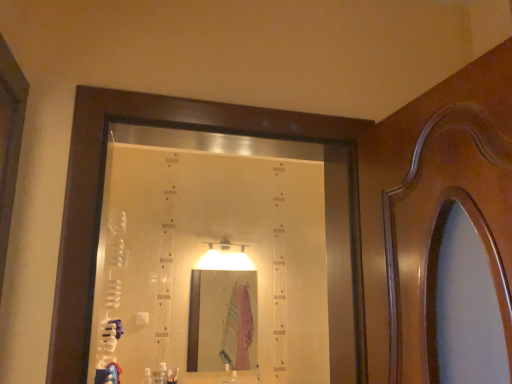
Question: Is white plastic bottle at lower center, positioned as the first toiletry in left-to-right order, positioned in front of pink fabric at center?

Choices:
 (A) yes
 (B) no

Answer: (A)

Question: Considering the relative positions of white plastic bottle at lower center, positioned as the first toiletry in left-to-right order, and pink fabric at center in the image provided, is white plastic bottle at lower center, positioned as the first toiletry in left-to-right order, to the left of pink fabric at center from the viewer's perspective?

Choices:
 (A) no
 (B) yes

Answer: (B)

Question: From a real-world perspective, is white plastic bottle at lower center, which is the second toiletry from right to left, located higher than pink fabric at center?

Choices:
 (A) yes
 (B) no

Answer: (B)

Question: Does white plastic bottle at lower center, positioned as the first toiletry in left-to-right order, have a greater height compared to pink fabric at center?

Choices:
 (A) yes
 (B) no

Answer: (B)

Question: Is white plastic bottle at lower center, positioned as the first toiletry in left-to-right order, placed right next to pink fabric at center?

Choices:
 (A) yes
 (B) no

Answer: (B)

Question: From the image's perspective, is pink fabric at center above or below blue cotton robe at lower left?

Choices:
 (A) above
 (B) below

Answer: (A)

Question: Considering their positions, is pink fabric at center located in front of or behind blue cotton robe at lower left?

Choices:
 (A) front
 (B) behind

Answer: (B)

Question: Is point [238, 322] closer or farther from the camera than point [102, 370]?

Choices:
 (A) closer
 (B) farther

Answer: (B)

Question: Is pink fabric at center situated inside blue cotton robe at lower left or outside?

Choices:
 (A) outside
 (B) inside

Answer: (A)

Question: Would you say white plastic bottle at lower center, which is the second toiletry from right to left, is to the left or to the right of clear plastic bottle at lower center, the 2th toiletry when ordered from left to right, in the picture?

Choices:
 (A) left
 (B) right

Answer: (A)

Question: From their relative heights in the image, would you say white plastic bottle at lower center, which is the second toiletry from right to left, is taller or shorter than clear plastic bottle at lower center, the 2th toiletry when ordered from left to right?

Choices:
 (A) short
 (B) tall

Answer: (A)

Question: Is white plastic bottle at lower center, which is the second toiletry from right to left, bigger or smaller than clear plastic bottle at lower center, the 1th toiletry when ordered from right to left?

Choices:
 (A) small
 (B) big

Answer: (A)

Question: Considering the positions of point (147, 372) and point (165, 380), is point (147, 372) closer or farther from the camera than point (165, 380)?

Choices:
 (A) closer
 (B) farther

Answer: (B)

Question: Is blue cotton robe at lower left bigger or smaller than clear plastic bottle at lower center, the 1th toiletry when ordered from right to left?

Choices:
 (A) big
 (B) small

Answer: (A)

Question: From the image's perspective, is blue cotton robe at lower left positioned above or below clear plastic bottle at lower center, the 1th toiletry when ordered from right to left?

Choices:
 (A) above
 (B) below

Answer: (A)